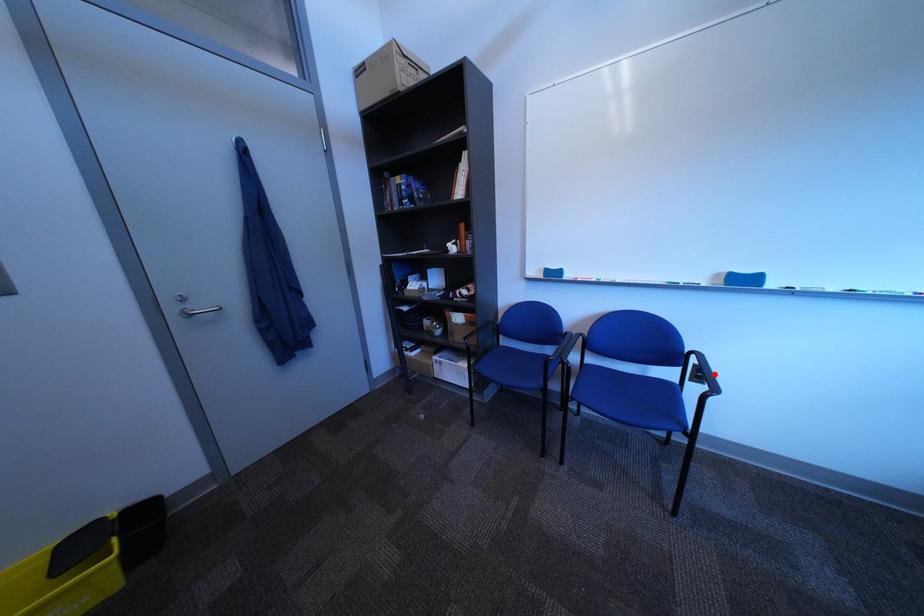
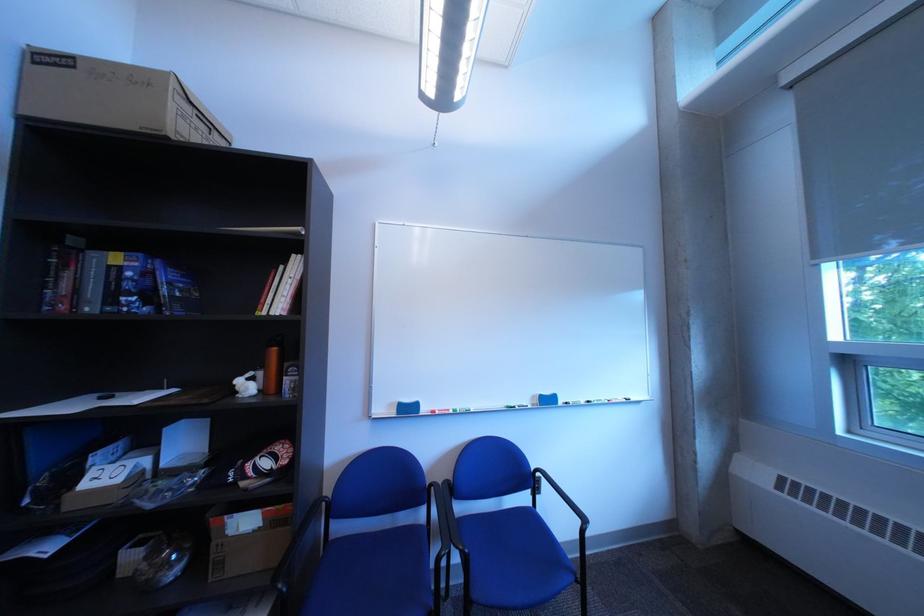
Question: I am providing you with two images of the same scene from different viewpoints. In image1, a red point is highlighted. Considering the same 3D point in image2, which of the following is correct?

Choices:
 (A) It is closer
 (B) It is farther

Answer: (B)